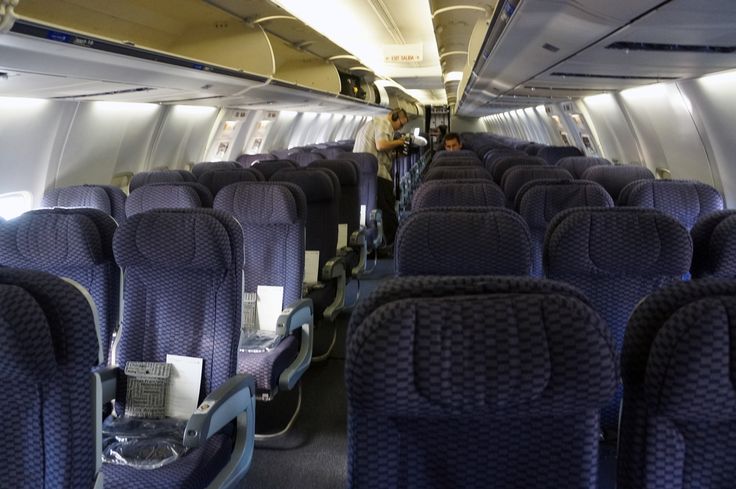
The height and width of the screenshot is (489, 736). I want to click on arm rest, so click(227, 392), click(289, 311), click(335, 261), click(341, 248), click(361, 232), click(375, 209).